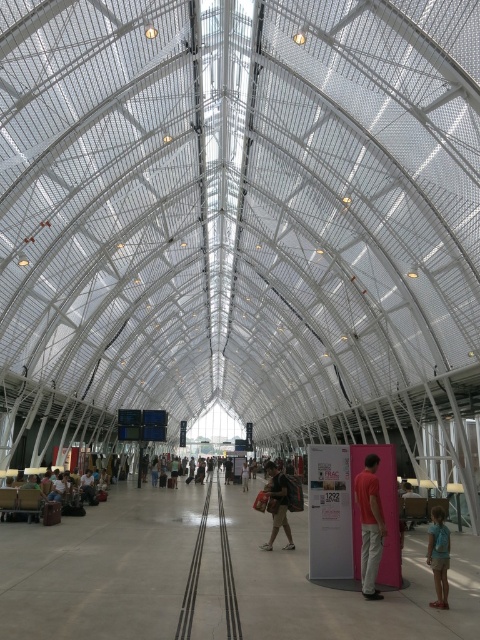
Consider the image. You are standing in the terminal and see the blue denim shorts at lower right and the dark brown leather backpack at center. Which item takes up more floor space?

The dark brown leather backpack at center takes up more floor space than the blue denim shorts at lower right because the blue denim shorts at lower right occupies less space than dark brown leather backpack at center.

You are a traveler carrying both the matte black backpack at center and the dark brown leather backpack at center. You need to place them on a bench that can only accommodate one backpack at a time. Based on their sizes, which backpack should you place first to ensure both can fit?

The dark brown leather backpack at center is narrower than the matte black backpack at center, so you should place the matte black backpack at center first to utilize the space effectively, allowing the narrower one to fit afterward.